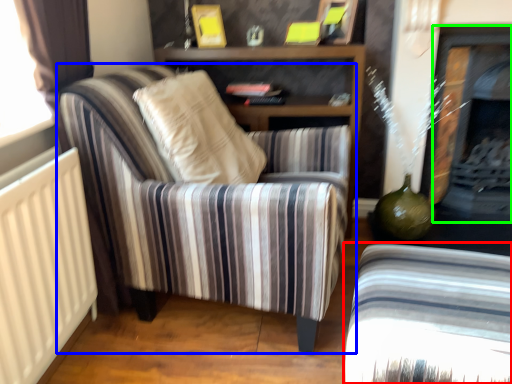
Question: Which object is the closest to the chair (highlighted by a red box)? Choose among these: chair (highlighted by a blue box) or fireplace (highlighted by a green box).

Choices:
 (A) chair
 (B) fireplace

Answer: (A)